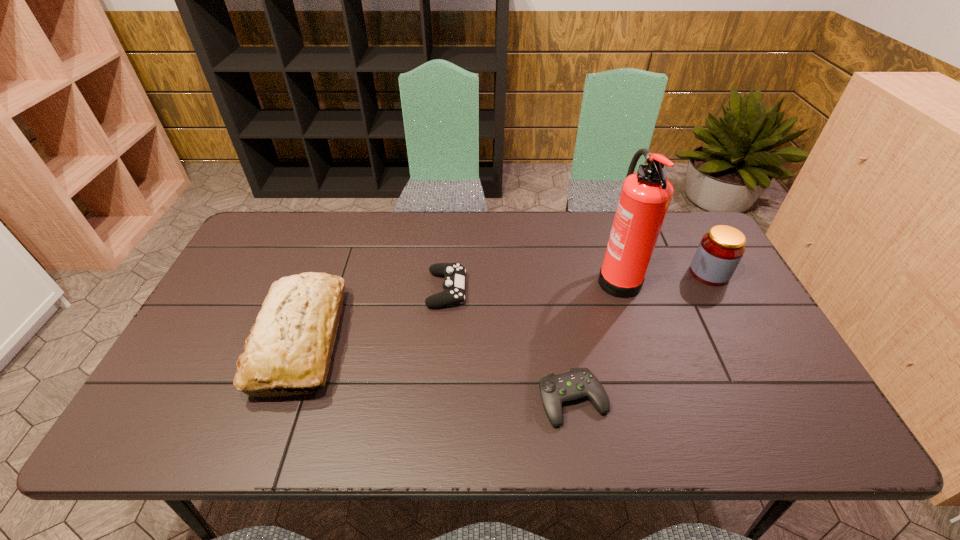
The width and height of the screenshot is (960, 540). I want to click on vacant area that lies between the jar and the second object from right to left, so click(663, 274).

Where is `free space between the farther control and the nearer control`? The image size is (960, 540). free space between the farther control and the nearer control is located at coordinates (510, 345).

This screenshot has height=540, width=960. In order to click on vacant point located between the nearer control and the bread in this screenshot , I will do `click(437, 370)`.

Where is `free space between the second object from right to left and the rightmost object`? free space between the second object from right to left and the rightmost object is located at coordinates (663, 274).

I want to click on free area in between the shorter control and the second object from right to left, so (x=595, y=338).

At what (x,y) coordinates should I click in order to perform the action: click on free space between the second object from right to left and the third object from left to right. Please return your answer as a coordinate pair (x, y). This screenshot has height=540, width=960. Looking at the image, I should click on (595, 338).

You are a GUI agent. You are given a task and a screenshot of the screen. Output one action in this format:
    pyautogui.click(x=<x>, y=<y>)
    Task: Click on the object that is the closest to the fourth object from left to right
    
    Given the screenshot: What is the action you would take?
    pyautogui.click(x=720, y=250)

At what (x,y) coordinates should I click in order to perform the action: click on the third closest object to the jar. Please return your answer as a coordinate pair (x, y). The width and height of the screenshot is (960, 540). Looking at the image, I should click on (454, 283).

The width and height of the screenshot is (960, 540). Identify the location of vacant area in the image that satisfies the following two spatial constraints: 1. on the back side of the right control; 2. on the left side of the rightmost object. (551, 273).

This screenshot has width=960, height=540. I want to click on free point that satisfies the following two spatial constraints: 1. on the surface of the nearer control; 2. on the right side of the farther control, so click(439, 400).